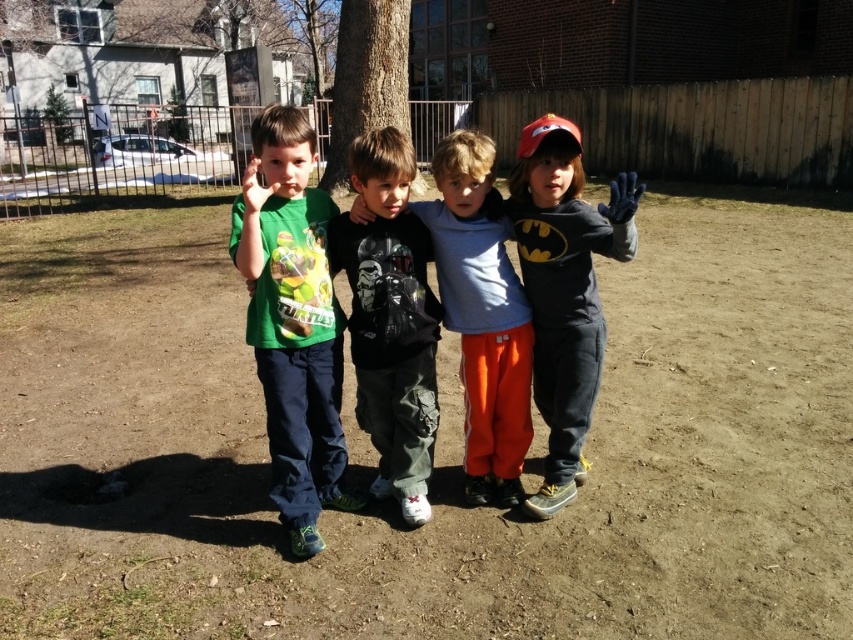
Who is higher up, dark gray cotton shirt at center or matte black shirt at center?

Positioned higher is matte black shirt at center.

Image resolution: width=853 pixels, height=640 pixels. Describe the element at coordinates (390, 320) in the screenshot. I see `dark gray cotton shirt at center` at that location.

Is point (363, 316) farther from camera compared to point (496, 256)?

No.

You are a GUI agent. You are given a task and a screenshot of the screen. Output one action in this format:
    pyautogui.click(x=<x>, y=<y>)
    Task: Click on the dark gray cotton shirt at center
    This screenshot has height=640, width=853.
    Given the screenshot: What is the action you would take?
    pyautogui.click(x=390, y=320)

Measure the distance between brown dirt field at center and matte black shirt at center.

brown dirt field at center and matte black shirt at center are 1.99 meters apart from each other.

Is brown dirt field at center above matte black shirt at center?

Indeed, brown dirt field at center is positioned over matte black shirt at center.

Does point (828, 413) come in front of point (521, 289)?

No, it is not.

You are a GUI agent. You are given a task and a screenshot of the screen. Output one action in this format:
    pyautogui.click(x=<x>, y=<y>)
    Task: Click on the brown dirt field at center
    Image resolution: width=853 pixels, height=640 pixels.
    Given the screenshot: What is the action you would take?
    pyautogui.click(x=434, y=448)

Who is more forward, (535, 298) or (474, 154)?

Point (474, 154)

Based on the photo, is bat signal hoodie at center further to the viewer compared to matte black shirt at center?

No, bat signal hoodie at center is closer to the viewer.

Between point (560, 196) and point (519, 388), which one is positioned in front?

Point (560, 196)

Locate an element on the screen. Image resolution: width=853 pixels, height=640 pixels. bat signal hoodie at center is located at coordinates (564, 289).